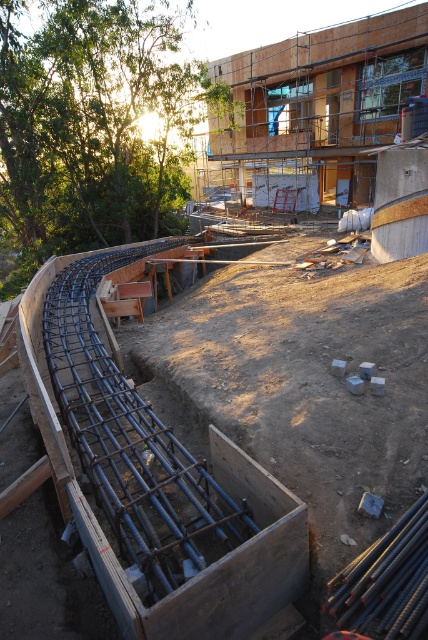
Does black metal rebar at lower left have a larger size compared to wooden scaffolding at upper center?

Incorrect, black metal rebar at lower left is not larger than wooden scaffolding at upper center.

Who is shorter, black metal rebar at lower left or wooden scaffolding at upper center?

black metal rebar at lower left

Between point (374, 454) and point (366, 195), which one is positioned behind?

Point (366, 195)

Identify the location of black metal rebar at lower left. Image resolution: width=428 pixels, height=640 pixels. (276, 429).